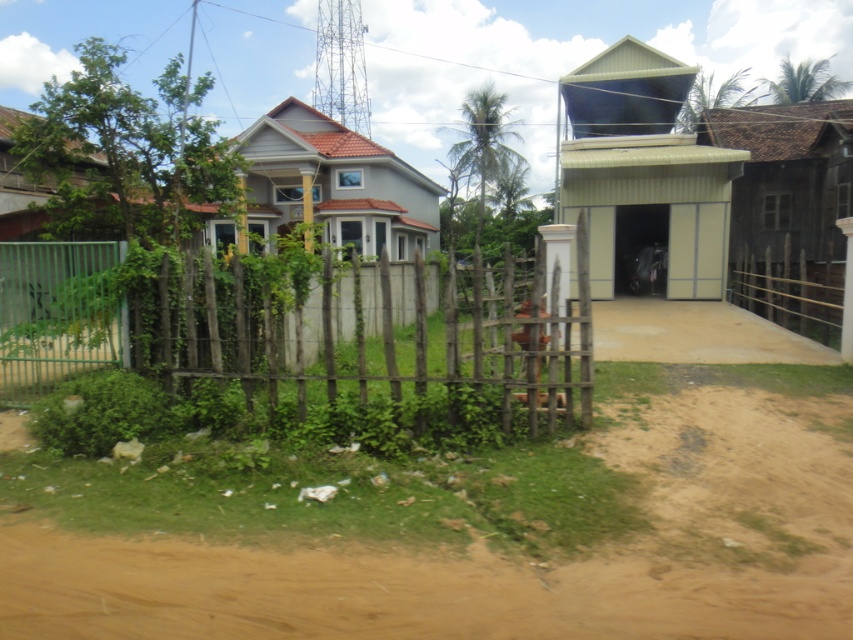
You are standing at the point marked by the coordinates point (643, 168) in the image. What structure are you facing?

You are facing the metallic corrugated hut at upper right as the point (643, 168) marks its location.

You are standing at the wooden fence on the left side of the image. Which direction should you walk to reach the wooden hut at right represented by point [788,209]?

The wooden hut at right represented by point [788,209] is located to your right side, so you should walk towards the right direction to reach it.